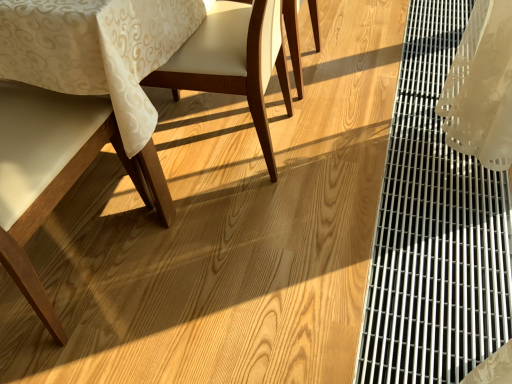
Question: Is matte white chair at left, which ranks as the first chair in left-to-right order, inside the boundaries of matte wood chair at center, which appears as the 3th chair when viewed from the left, or outside?

Choices:
 (A) outside
 (B) inside

Answer: (A)

Question: From the image's perspective, is matte white chair at left, which appears as the fourth chair when viewed from the right, above or below matte wood chair at center, which appears as the 3th chair when viewed from the left?

Choices:
 (A) below
 (B) above

Answer: (A)

Question: Estimate the real-world distances between objects in this image. Which object is farther from the wooden chair at center, acting as the 4th chair starting from the left?

Choices:
 (A) matte white chair at left, which appears as the fourth chair when viewed from the right
 (B) matte wood chair at left, the third chair positioned from the right
 (C) matte wood chair at center, the second chair when ordered from right to left
 (D) metallic grid at right

Answer: (A)

Question: Estimate the real-world distances between objects in this image. Which object is closer to the matte wood chair at left, the third chair positioned from the right?

Choices:
 (A) matte white chair at left, which ranks as the first chair in left-to-right order
 (B) metallic grid at right
 (C) matte wood chair at center, which appears as the 3th chair when viewed from the left
 (D) wooden chair at center, positioned as the first chair in right-to-left order

Answer: (A)